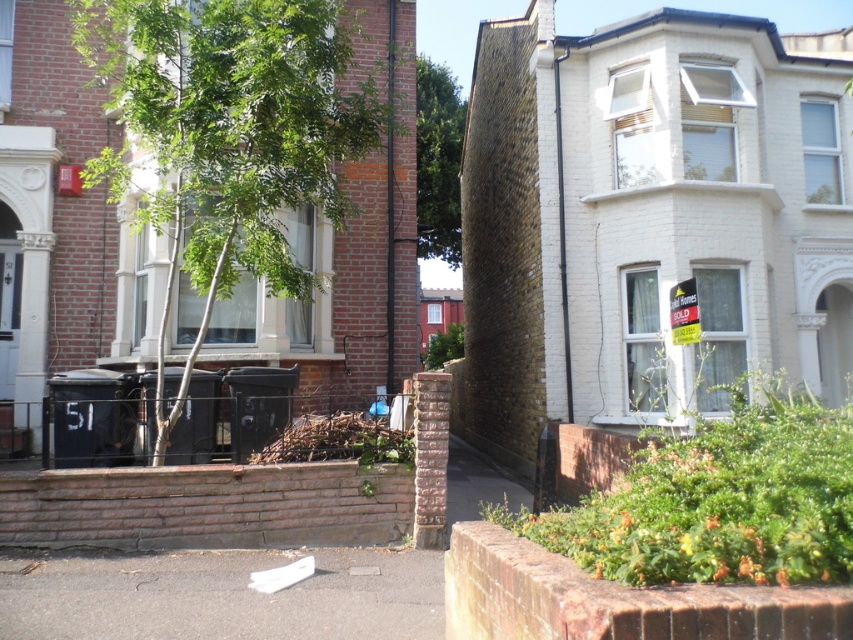
You are a delivery person trying to determine the best route to deliver packages to both houses. The red brick house is behind the green leafy tree at left, and the white house is behind the green leafy tree at upper center. Which tree should you go around to reach the red brick house first?

The green leafy tree at left is in front of the green leafy tree at upper center. To reach the red brick house first, you should go around the green leafy tree at left since it is closer to the red brick house and blocking its access.

From the picture: You are a delivery person trying to park your van on the white asphalt at lower center. There is a green leafy tree at upper center nearby. Based on the scene, can you safely park your van there without hitting the tree?

The white asphalt at lower center is to the left of the green leafy tree at upper center, so parking there should be safe as the tree is positioned above and to the right, not directly in the path of the parking area.